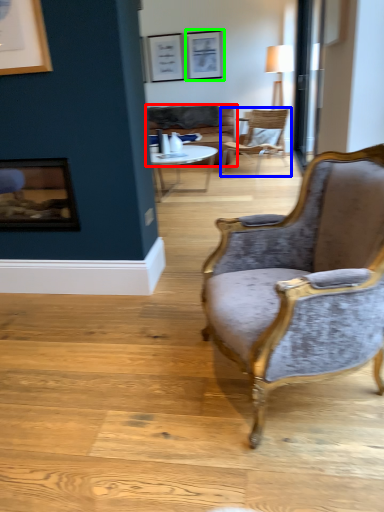
Question: Estimate the real-world distances between objects in this image. Which object is farther from studio couch (highlighted by a red box), chair (highlighted by a blue box) or picture frame (highlighted by a green box)?

Choices:
 (A) chair
 (B) picture frame

Answer: (B)